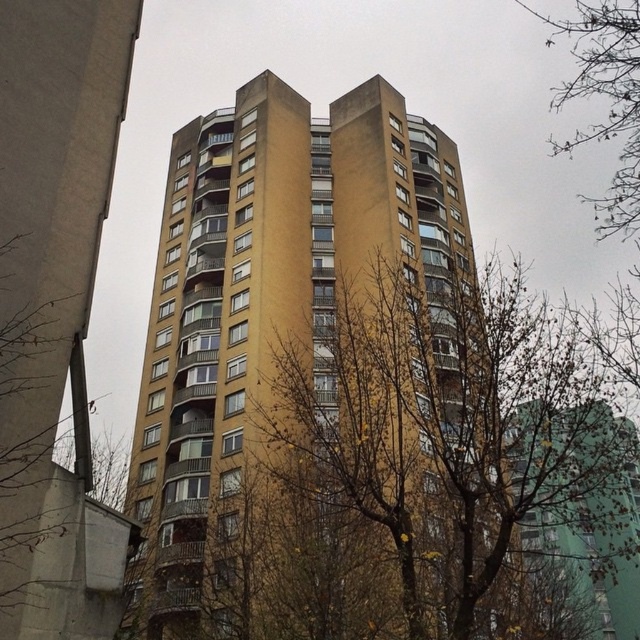
Question: Which point is farther to the camera?

Choices:
 (A) (296, 125)
 (B) (588, 84)

Answer: (A)

Question: Is bare branches at center positioned before bare branches at upper right?

Choices:
 (A) no
 (B) yes

Answer: (B)

Question: Which is farther from the yellow concrete building at center?

Choices:
 (A) bare branches at upper right
 (B) bare branches at center

Answer: (A)

Question: Is yellow concrete building at center above bare branches at upper right?

Choices:
 (A) yes
 (B) no

Answer: (B)

Question: Which point is farther to the camera?

Choices:
 (A) (481, 410)
 (B) (308, 200)
 (C) (634, 36)

Answer: (B)

Question: Is bare branches at center closer to the viewer compared to yellow concrete building at center?

Choices:
 (A) yes
 (B) no

Answer: (A)